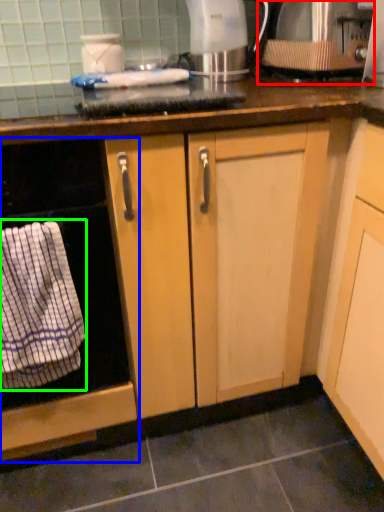
Question: Considering the real-world distances, which object is farthest from kitchen appliance (highlighted by a red box)? home appliance (highlighted by a blue box) or bath towel (highlighted by a green box)?

Choices:
 (A) home appliance
 (B) bath towel

Answer: (B)